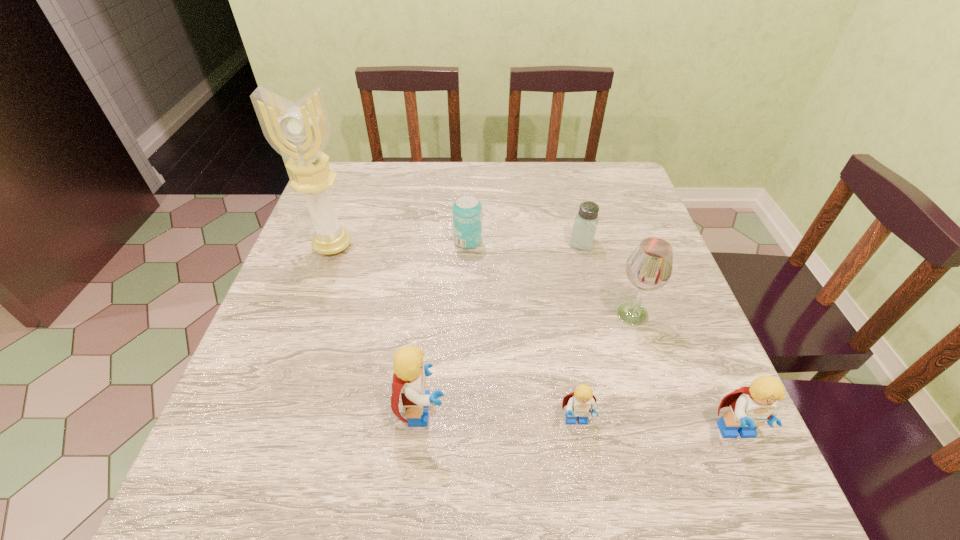
The image size is (960, 540). I want to click on vacant space at the far edge of the desktop, so click(567, 164).

Where is `free space at the left edge of the desktop`? The height and width of the screenshot is (540, 960). free space at the left edge of the desktop is located at coordinates (340, 311).

You are a GUI agent. You are given a task and a screenshot of the screen. Output one action in this format:
    pyautogui.click(x=<x>, y=<y>)
    Task: Click on the vacant area at the right edge
    The width and height of the screenshot is (960, 540).
    Given the screenshot: What is the action you would take?
    pyautogui.click(x=670, y=366)

You are a GUI agent. You are given a task and a screenshot of the screen. Output one action in this format:
    pyautogui.click(x=<x>, y=<y>)
    Task: Click on the vacant space at the far left corner of the desktop
    The height and width of the screenshot is (540, 960).
    Given the screenshot: What is the action you would take?
    pyautogui.click(x=361, y=190)

This screenshot has height=540, width=960. In the image, there is a desktop. What are the coordinates of `vacant region at the far right corner` in the screenshot? It's located at (607, 181).

You are a GUI agent. You are given a task and a screenshot of the screen. Output one action in this format:
    pyautogui.click(x=<x>, y=<y>)
    Task: Click on the free space between the second shortest Lego and the saltshaker
    
    Given the screenshot: What is the action you would take?
    pyautogui.click(x=660, y=338)

Identify the location of vacant region between the fourth object from right to left and the saltshaker. (580, 332).

Find the location of a particular element. The width and height of the screenshot is (960, 540). empty location between the second shortest Lego and the award is located at coordinates (535, 340).

This screenshot has height=540, width=960. In order to click on unoccupied position between the leftmost Lego and the saltshaker in this screenshot , I will do `click(502, 326)`.

Where is `vacant area that lies between the fourth farthest object and the leftmost Lego`? The width and height of the screenshot is (960, 540). vacant area that lies between the fourth farthest object and the leftmost Lego is located at coordinates [528, 362].